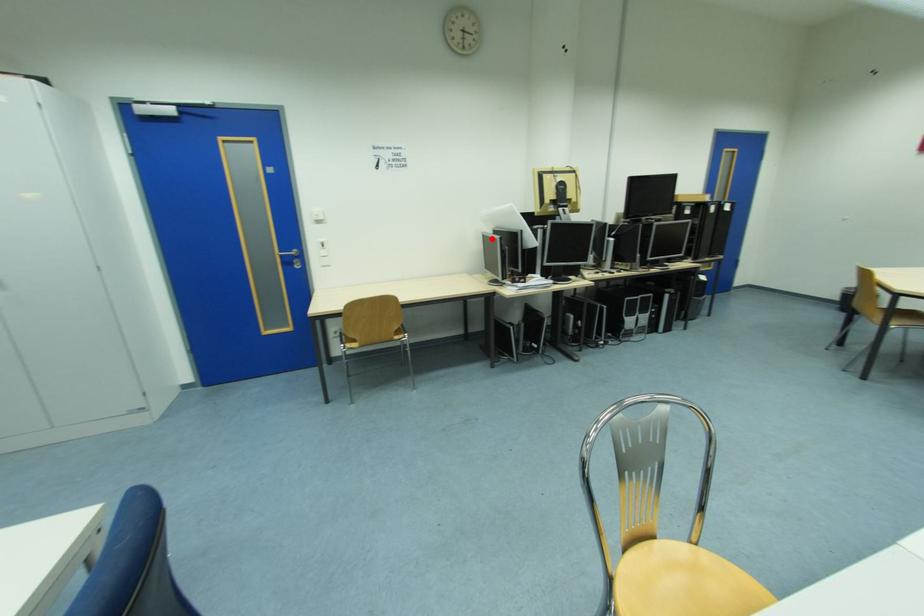
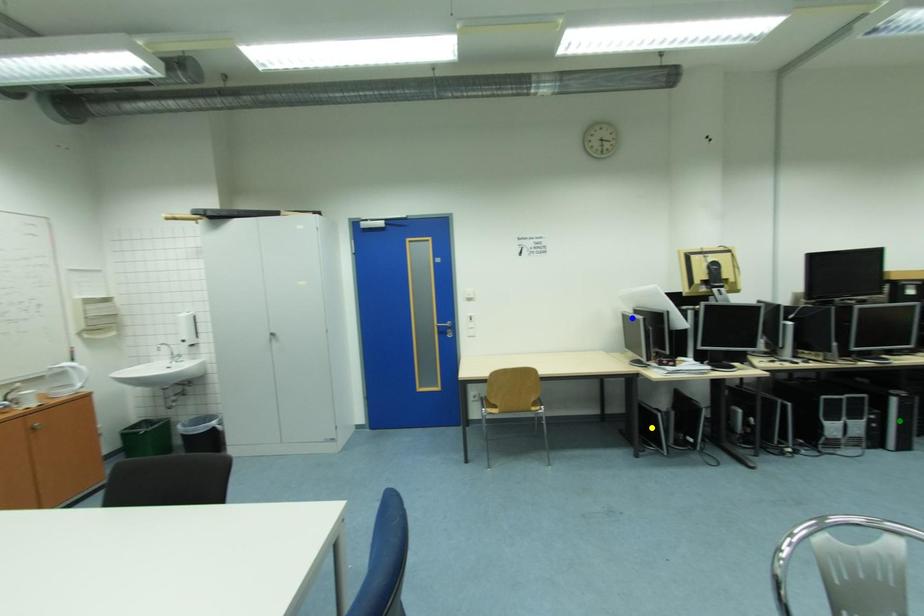
Question: I am providing you with two images of the same scene from different viewpoints. A red point is marked on the first image. You are given multiple points on the second image. Can you choose the point in image 2 that corresponds to the point in image 1?

Choices:
 (A) yellow point
 (B) blue point
 (C) green point

Answer: (B)